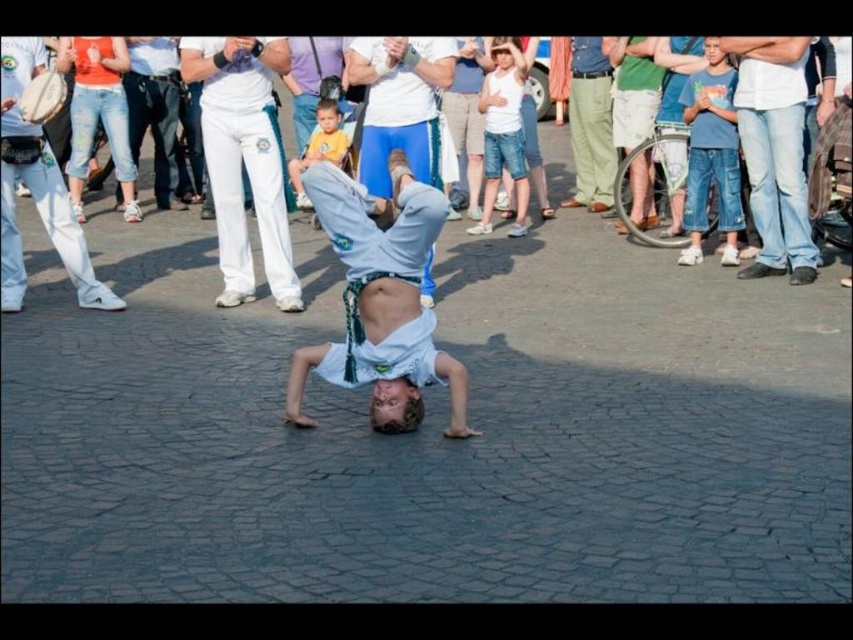
Between white cotton pants at center and yellow cotton shirt at center, which one appears on the left side from the viewer's perspective?

From the viewer's perspective, yellow cotton shirt at center appears more on the left side.

Is white cotton pants at center further to the viewer compared to yellow cotton shirt at center?

No, white cotton pants at center is closer to the viewer.

Does point (329, 54) come farther from viewer compared to point (311, 205)?

Yes.

The image size is (853, 640). I want to click on white cotton pants at center, so click(x=224, y=148).

Does point (202, 45) lie behind point (393, 140)?

Yes, it is.

Does white cotton pants at upper center appear on the left side of white fabric shirt at center?

Correct, you'll find white cotton pants at upper center to the left of white fabric shirt at center.

Does point (270, 129) come behind point (380, 52)?

Yes, point (270, 129) is farther from viewer.

You are a GUI agent. You are given a task and a screenshot of the screen. Output one action in this format:
    pyautogui.click(x=<x>, y=<y>)
    Task: Click on the white cotton pants at upper center
    The image size is (853, 640).
    Given the screenshot: What is the action you would take?
    pyautogui.click(x=242, y=157)

Is point (341, 353) farther from camera compared to point (698, 234)?

No, it is in front of (698, 234).

Between point (421, 410) and point (689, 93), which one is positioned in front?

Point (421, 410) is in front.

Locate an element on the screen. white cotton shirt at center is located at coordinates (380, 301).